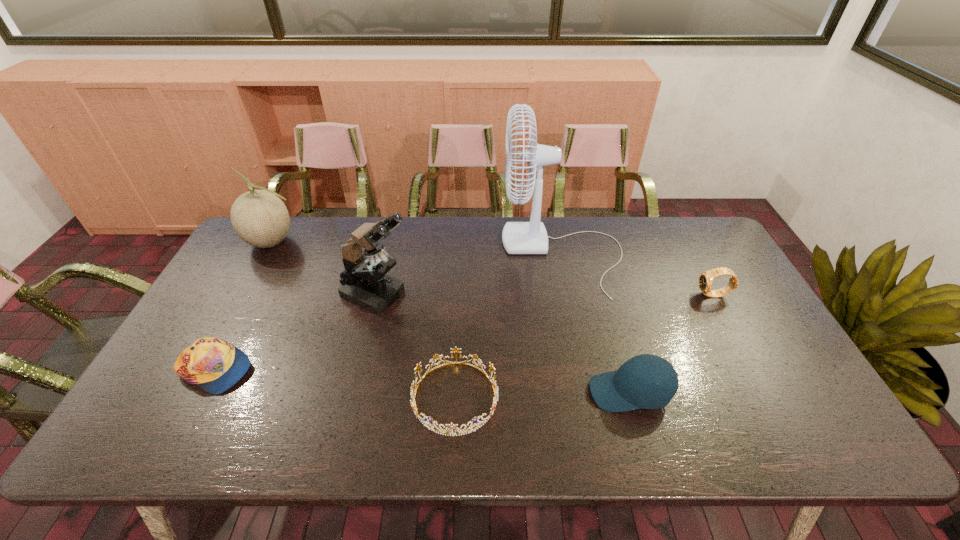
Identify the location of vacant area situated on the front-facing side of the tallest object. This screenshot has width=960, height=540. (440, 254).

Where is `vacant space located on the front-facing side of the tallest object`? vacant space located on the front-facing side of the tallest object is located at coordinates (478, 254).

Identify the location of blank space located 0.180m on the front of the fifth object from right to left. The image size is (960, 540). (359, 369).

The height and width of the screenshot is (540, 960). What are the coordinates of `free space located on the right of the third tallest object` in the screenshot? It's located at (407, 241).

Find the location of a particular element. free location located 0.240m on the front-facing side of the baseball cap is located at coordinates tap(492, 392).

Find the location of `vacant space located on the front-facing side of the baseball cap`. vacant space located on the front-facing side of the baseball cap is located at coordinates (544, 392).

This screenshot has width=960, height=540. I want to click on free region located on the front-facing side of the baseball cap, so click(479, 392).

Locate an element on the screen. This screenshot has width=960, height=540. free location located 0.220m on the face of the watch is located at coordinates (625, 295).

Find the location of a particular element. vacant space situated on the face of the watch is located at coordinates (x=564, y=295).

Locate an element on the screen. This screenshot has height=540, width=960. free region located 0.180m on the face of the watch is located at coordinates (637, 295).